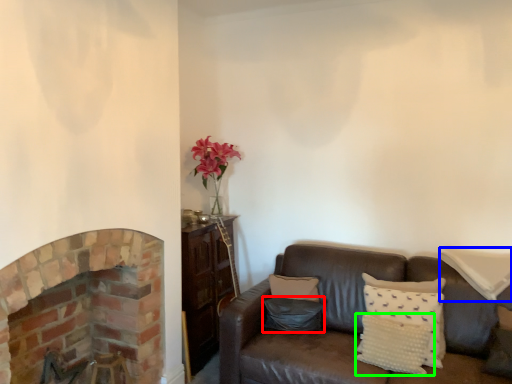
Question: Considering the real-world distances, which object is farthest from pillow (highlighted by a red box)? pillow (highlighted by a blue box) or pillow (highlighted by a green box)?

Choices:
 (A) pillow
 (B) pillow

Answer: (A)